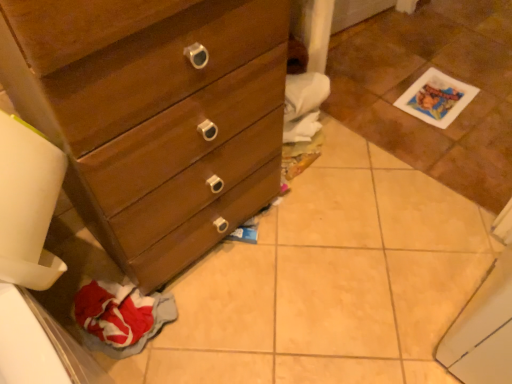
Question: From a real-world perspective, is matte wood chest of drawers at lower left located beneath white glossy tile at lower right?

Choices:
 (A) no
 (B) yes

Answer: (A)

Question: Could white glossy tile at lower right be considered to be inside matte wood chest of drawers at lower left?

Choices:
 (A) no
 (B) yes

Answer: (A)

Question: Is matte wood chest of drawers at lower left thinner than white glossy tile at lower right?

Choices:
 (A) no
 (B) yes

Answer: (B)

Question: From the image's perspective, would you say matte wood chest of drawers at lower left is positioned over white glossy tile at lower right?

Choices:
 (A) yes
 (B) no

Answer: (B)

Question: Is white glossy tile at lower right at the back of matte wood chest of drawers at lower left?

Choices:
 (A) yes
 (B) no

Answer: (B)

Question: Can you confirm if matte wood chest of drawers at lower left is taller than white glossy tile at lower right?

Choices:
 (A) no
 (B) yes

Answer: (B)

Question: Is white glossy tile at lower right positioned with its back to matte wood chest of drawers at lower left?

Choices:
 (A) yes
 (B) no

Answer: (B)

Question: Are white glossy tile at lower right and matte wood chest of drawers at lower left beside each other?

Choices:
 (A) yes
 (B) no

Answer: (B)

Question: Is white glossy tile at lower right to the left of matte wood chest of drawers at lower left from the viewer's perspective?

Choices:
 (A) yes
 (B) no

Answer: (B)

Question: Considering the relative sizes of white glossy tile at lower right and matte wood chest of drawers at lower left in the image provided, is white glossy tile at lower right shorter than matte wood chest of drawers at lower left?

Choices:
 (A) no
 (B) yes

Answer: (B)

Question: Is there a large distance between white glossy tile at lower right and matte wood chest of drawers at lower left?

Choices:
 (A) yes
 (B) no

Answer: (B)

Question: Is white glossy tile at lower right behind matte wood chest of drawers at lower left?

Choices:
 (A) yes
 (B) no

Answer: (A)

Question: Considering the positions of white glossy tile at lower right and matte wood chest of drawers at lower left in the image, is white glossy tile at lower right taller or shorter than matte wood chest of drawers at lower left?

Choices:
 (A) short
 (B) tall

Answer: (A)